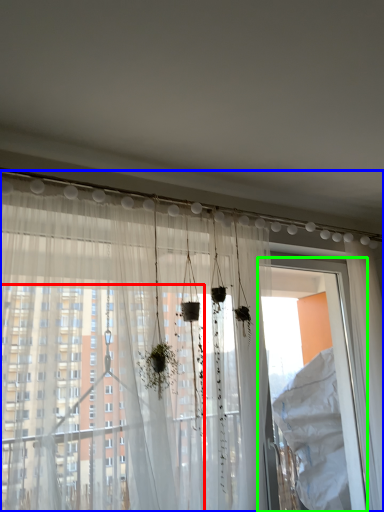
Question: Based on their relative distances, which object is nearer to window (highlighted by a red box)? Choose from curtain (highlighted by a blue box) and screen door (highlighted by a green box).

Choices:
 (A) curtain
 (B) screen door

Answer: (A)